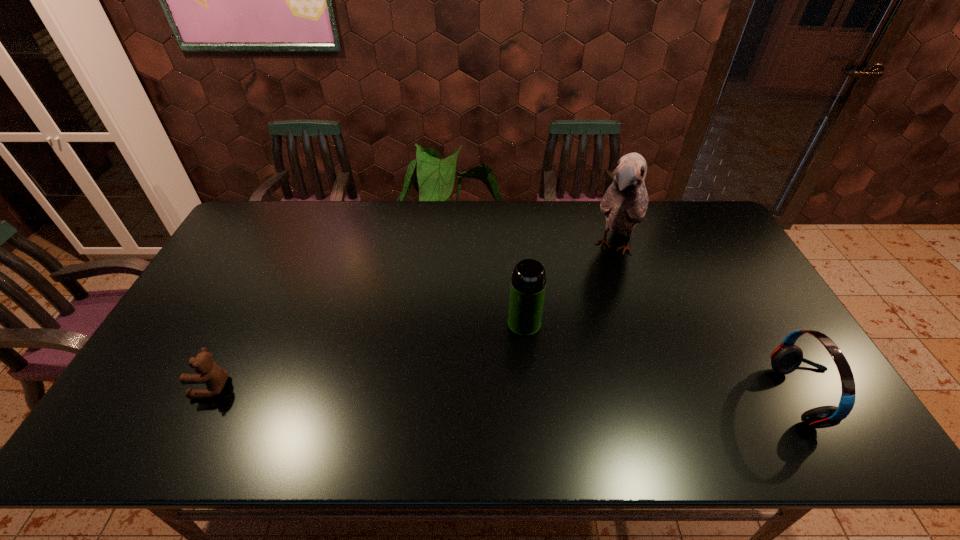
This screenshot has height=540, width=960. I want to click on the shortest object, so click(x=207, y=371).

This screenshot has width=960, height=540. What are the coordinates of `the leftmost object` in the screenshot? It's located at (x=207, y=371).

The image size is (960, 540). What are the coordinates of `headset` in the screenshot? It's located at (785, 359).

Locate an element on the screen. the rightmost object is located at coordinates (785, 359).

At what (x,y) coordinates should I click in order to perform the action: click on the tallest object. Please return your answer as a coordinate pair (x, y). Looking at the image, I should click on (625, 202).

Where is `the third object from left to right`? The width and height of the screenshot is (960, 540). the third object from left to right is located at coordinates (625, 202).

You are a GUI agent. You are given a task and a screenshot of the screen. Output one action in this format:
    pyautogui.click(x=<x>, y=<y>)
    Task: Click on the thermos bottle
    The image size is (960, 540).
    Given the screenshot: What is the action you would take?
    pyautogui.click(x=528, y=283)

This screenshot has height=540, width=960. In order to click on the third nearest object in this screenshot , I will do `click(528, 283)`.

You are a GUI agent. You are given a task and a screenshot of the screen. Output one action in this format:
    pyautogui.click(x=<x>, y=<y>)
    Task: Click on the free spot located 0.150m on the face of the shortest object
    The image size is (960, 540).
    Given the screenshot: What is the action you would take?
    pyautogui.click(x=136, y=387)

What are the coordinates of `vacant area situated on the face of the shortest object` in the screenshot? It's located at [136, 387].